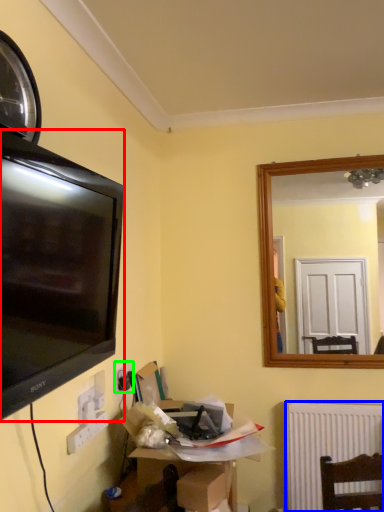
Question: Which is farther away from television (highlighted by a red box)? radiator (highlighted by a blue box) or electric outlet (highlighted by a green box)?

Choices:
 (A) radiator
 (B) electric outlet

Answer: (A)